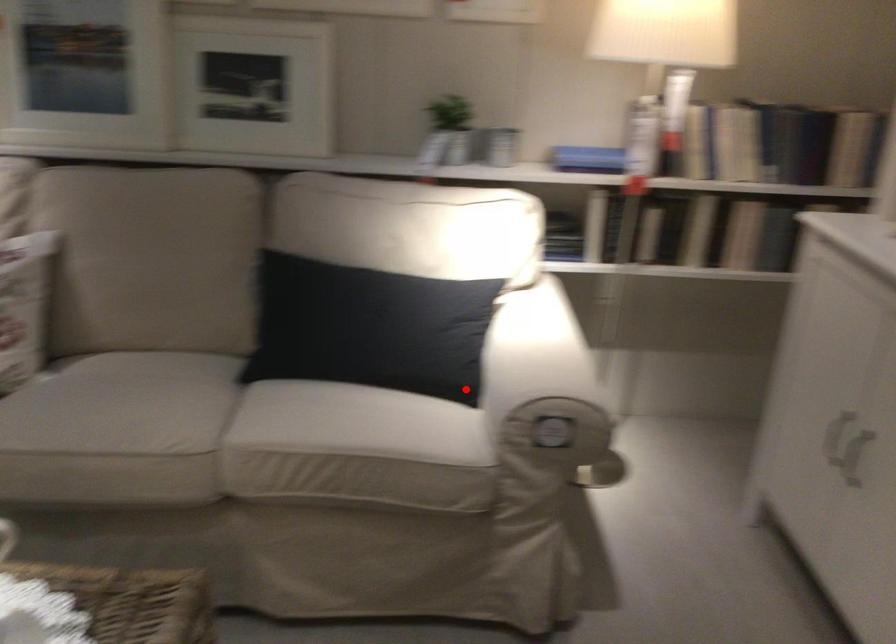
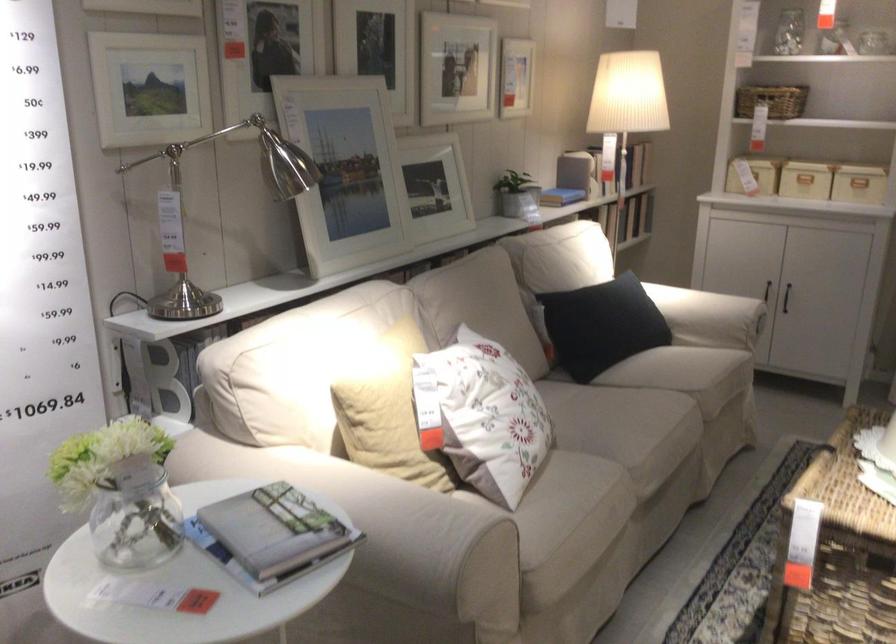
Question: I am providing you with two images of the same scene from different viewpoints. Given a red point in image1, look at the same physical point in image2. Is it:

Choices:
 (A) Closer to the viewpoint
 (B) Farther from the viewpoint

Answer: (B)